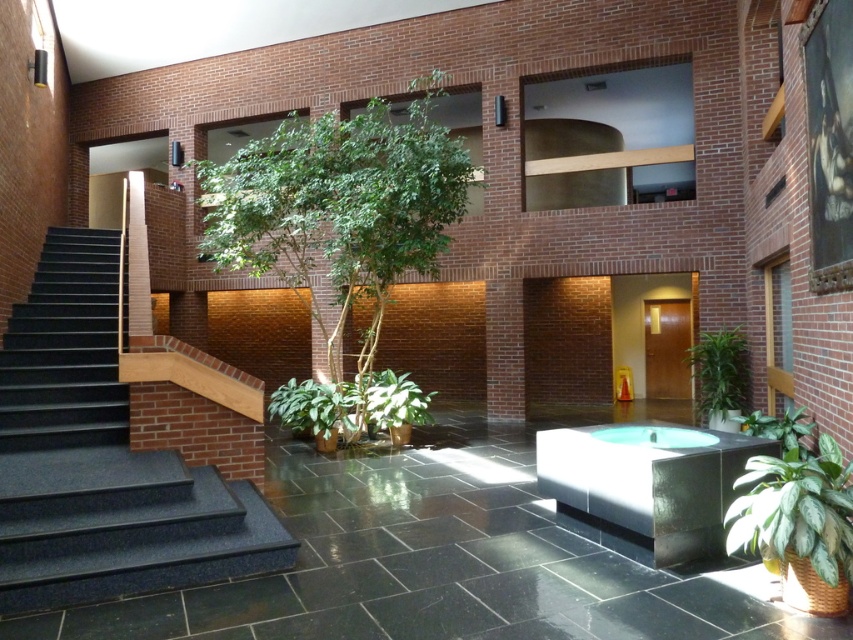
This screenshot has width=853, height=640. I want to click on granite steps at left, so click(102, 460).

This screenshot has height=640, width=853. I want to click on granite steps at left, so click(x=102, y=460).

Is polished stainless steel jacuzzi at center shorter than green leafy plant at lower right?

In fact, polished stainless steel jacuzzi at center may be taller than green leafy plant at lower right.

Does point (538, 456) lie behind point (752, 422)?

No, (538, 456) is closer to viewer.

Locate an element on the screen. polished stainless steel jacuzzi at center is located at coordinates (646, 484).

Can you confirm if green leafy tree at center is positioned to the right of green glossy plant at right?

In fact, green leafy tree at center is to the left of green glossy plant at right.

Who is positioned more to the right, green leafy tree at center or green glossy plant at right?

Positioned to the right is green glossy plant at right.

This screenshot has width=853, height=640. I want to click on green leafy tree at center, so click(x=341, y=209).